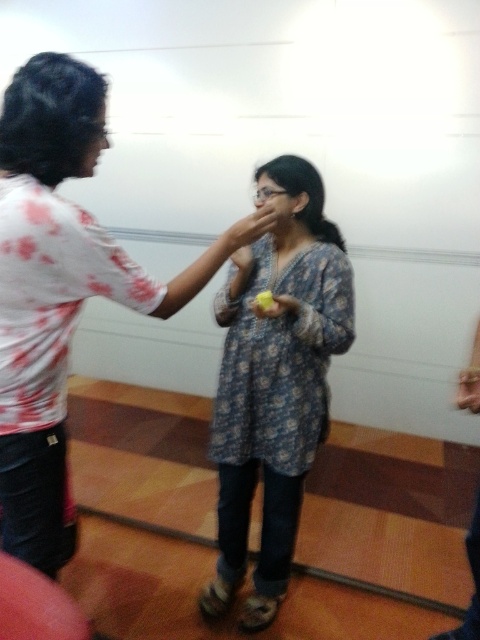
Question: Which point appears closest to the camera in this image?

Choices:
 (A) (61, 456)
 (B) (244, 470)
 (C) (216, 252)
 (D) (297, 304)

Answer: (C)

Question: Can you confirm if floral-patterned dress at center is wider than floral-patterned fabric dress at center?

Choices:
 (A) no
 (B) yes

Answer: (B)

Question: Which object is the farthest from the yellow matte apple at center?

Choices:
 (A) matte skin hand at center
 (B) floral-patterned fabric dress at center

Answer: (B)

Question: Which of the following is the closest to the observer?

Choices:
 (A) (333, 348)
 (B) (76, 243)

Answer: (B)

Question: Is floral-patterned dress at center in front of matte skin hand at center?

Choices:
 (A) no
 (B) yes

Answer: (B)

Question: Is matte skin hand at center to the left of yellow matte apple at center from the viewer's perspective?

Choices:
 (A) no
 (B) yes

Answer: (B)